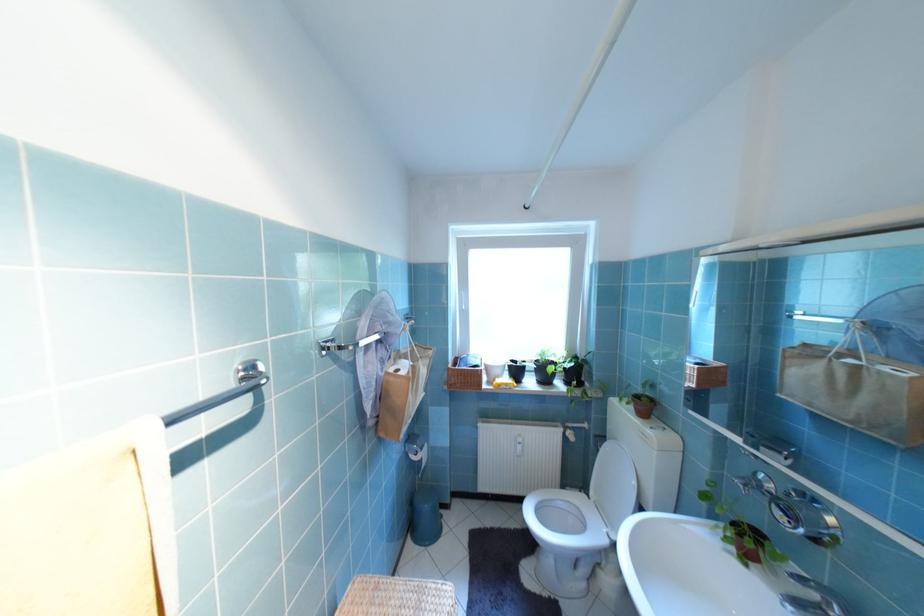
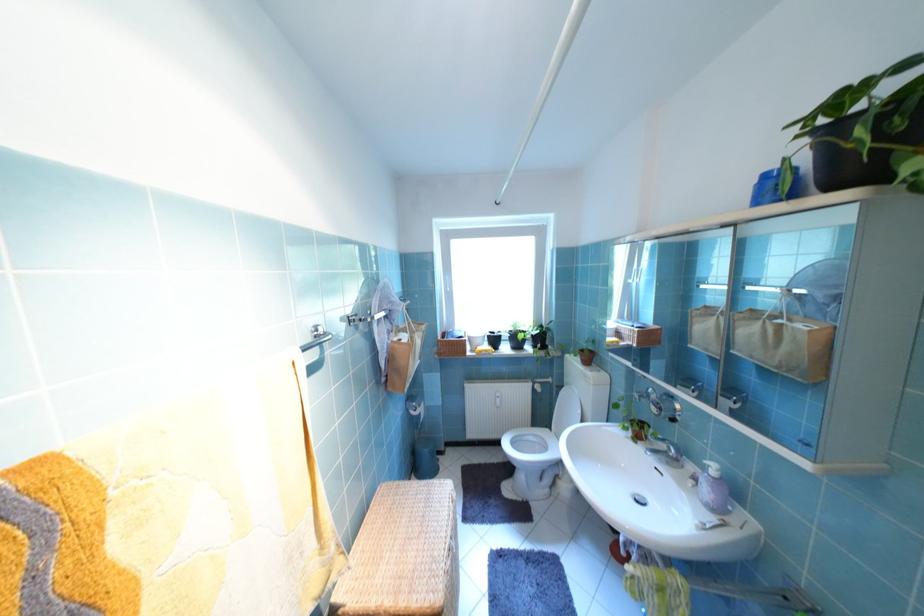
Question: The camera is either moving clockwise (left) or counter-clockwise (right) around the object. The first image is from the beginning of the video and the second image is from the end. Is the camera moving left or right when shooting the video?

Choices:
 (A) Left
 (B) Right

Answer: (A)